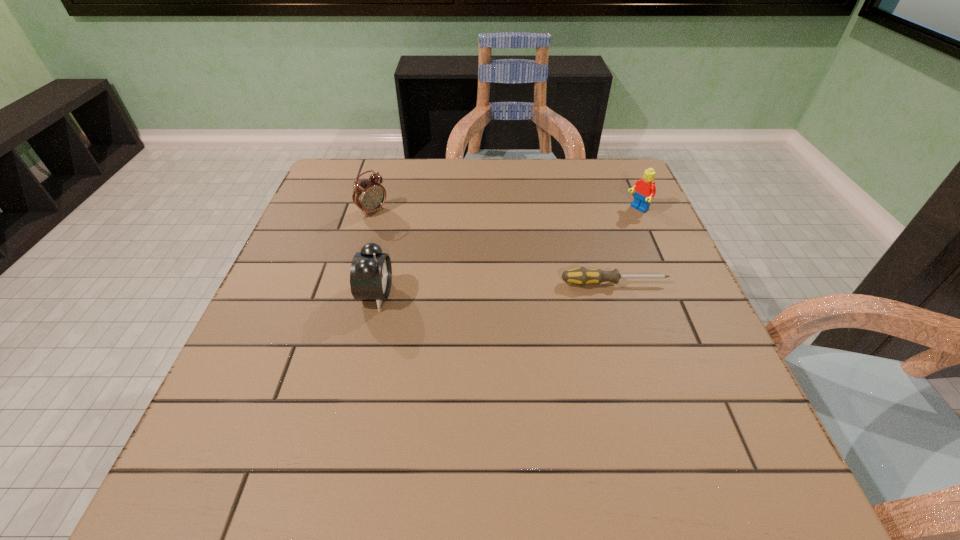
This screenshot has height=540, width=960. Find the location of `unoccupied area between the nearer alarm clock and the screwdriver`. unoccupied area between the nearer alarm clock and the screwdriver is located at coordinates (495, 289).

Find the location of a particular element. This screenshot has height=540, width=960. the closest object to the farther alarm clock is located at coordinates (371, 272).

Locate which object is the third closest to the screwdriver. Please provide its 2D coordinates. Your answer should be formatted as a tuple, i.e. [(x, y)], where the tuple contains the x and y coordinates of a point satisfying the conditions above.

[(369, 195)]

Locate an element on the screen. free point that satisfies the following two spatial constraints: 1. on the front side of the nearer alarm clock; 2. on the front side of the farther alarm clock is located at coordinates (348, 295).